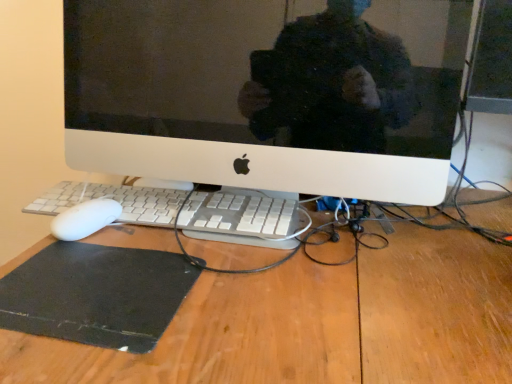
Question: From a real-world perspective, is black rubber mousepad at lower left physically below white plastic keyboard at center?

Choices:
 (A) no
 (B) yes

Answer: (B)

Question: Is black rubber mousepad at lower left closer to camera compared to white plastic keyboard at center?

Choices:
 (A) yes
 (B) no

Answer: (A)

Question: Is black rubber mousepad at lower left outside white plastic keyboard at center?

Choices:
 (A) no
 (B) yes

Answer: (B)

Question: Can white plastic keyboard at center be found inside black rubber mousepad at lower left?

Choices:
 (A) yes
 (B) no

Answer: (B)

Question: Does black rubber mousepad at lower left lie behind white plastic keyboard at center?

Choices:
 (A) no
 (B) yes

Answer: (A)

Question: From the image's perspective, is black rubber mousepad at lower left positioned above or below wooden desk at center?

Choices:
 (A) below
 (B) above

Answer: (B)

Question: Does point (159, 324) appear closer or farther from the camera than point (441, 309)?

Choices:
 (A) closer
 (B) farther

Answer: (A)

Question: Do you think black rubber mousepad at lower left is within wooden desk at center, or outside of it?

Choices:
 (A) outside
 (B) inside

Answer: (B)

Question: From a real-world perspective, is black rubber mousepad at lower left above or below wooden desk at center?

Choices:
 (A) below
 (B) above

Answer: (B)

Question: Considering their positions, is wooden desk at center located in front of or behind white plastic keyboard at center?

Choices:
 (A) front
 (B) behind

Answer: (A)

Question: Choose the correct answer: Is wooden desk at center inside white plastic keyboard at center or outside it?

Choices:
 (A) outside
 (B) inside

Answer: (A)

Question: Would you say wooden desk at center is to the left or to the right of white plastic keyboard at center in the picture?

Choices:
 (A) left
 (B) right

Answer: (B)

Question: From the image's perspective, is wooden desk at center above or below white plastic keyboard at center?

Choices:
 (A) below
 (B) above

Answer: (A)

Question: From the image's perspective, is black rubber mousepad at lower left positioned above or below white plastic keyboard at center?

Choices:
 (A) above
 (B) below

Answer: (B)

Question: From their relative heights in the image, would you say black rubber mousepad at lower left is taller or shorter than white plastic keyboard at center?

Choices:
 (A) tall
 (B) short

Answer: (B)